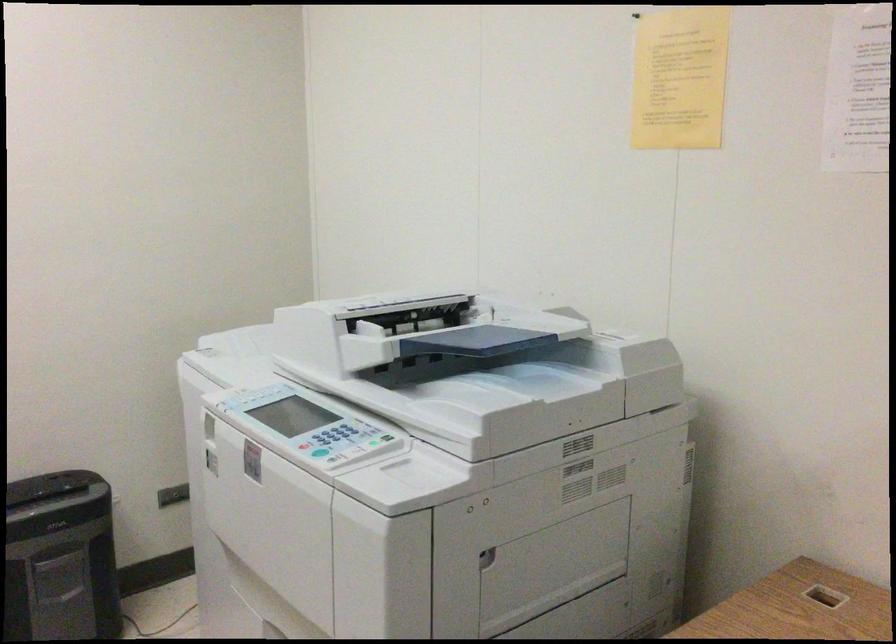
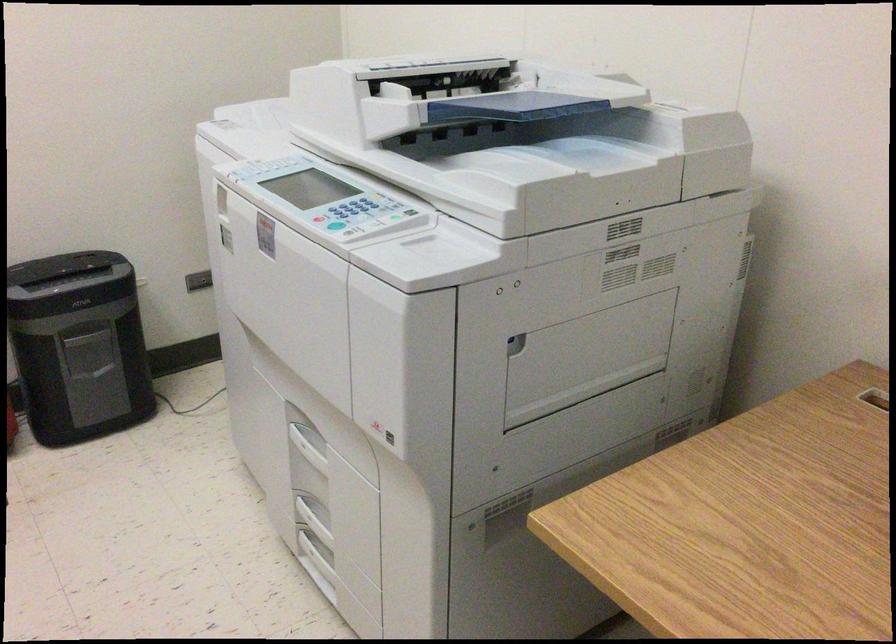
The point at (557,558) is marked in the first image. Where is the corresponding point in the second image?

(589, 348)